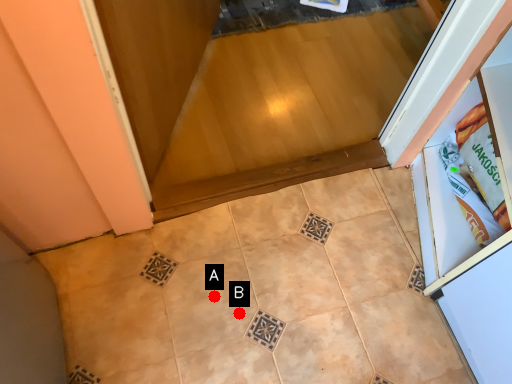
Question: Two points are circled on the image, labeled by A and B beside each circle. Which point appears closest to the camera in this image?

Choices:
 (A) A is closer
 (B) B is closer

Answer: (B)